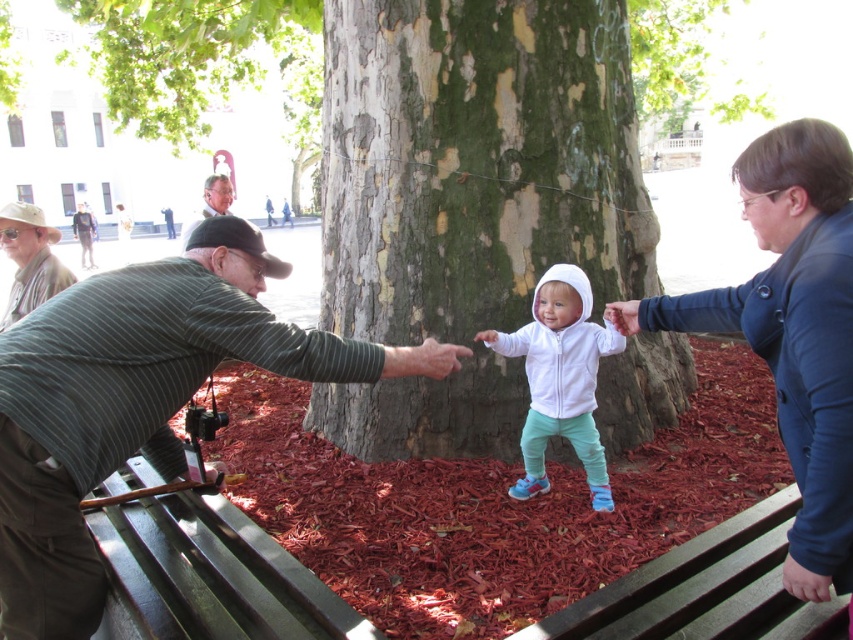
You are standing at the point marked as point (792,332) in the image. What object is directly in front of you?

The blue fabric jacket at center is directly in front of you at point (792,332).

You are standing in the park and see two people sitting on the bench. The first person is wearing a striped fabric shirt at left, and the second is wearing a white fleece jacket at center. Which clothing item is positioned more to the left?

The striped fabric shirt at left is positioned more to the left than the white fleece jacket at center.

You are standing in the park and see the green bark tree trunk at center and the matte black cap at left. Which object is shorter?

The green bark tree trunk at center is shorter than the matte black cap at left.